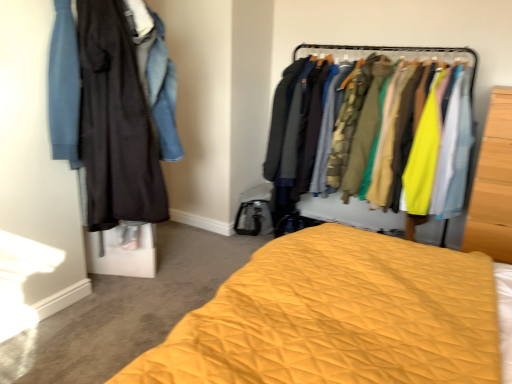
Question: Does textured fabric clothes at center appear on the left side of wooden wardrobe at right?

Choices:
 (A) yes
 (B) no

Answer: (A)

Question: Considering the relative sizes of textured fabric clothes at center and wooden wardrobe at right in the image provided, is textured fabric clothes at center taller than wooden wardrobe at right?

Choices:
 (A) yes
 (B) no

Answer: (A)

Question: Can you confirm if textured fabric clothes at center is bigger than wooden wardrobe at right?

Choices:
 (A) no
 (B) yes

Answer: (B)

Question: Does textured fabric clothes at center appear on the right side of wooden wardrobe at right?

Choices:
 (A) yes
 (B) no

Answer: (B)

Question: Would you say textured fabric clothes at center contains wooden wardrobe at right?

Choices:
 (A) yes
 (B) no

Answer: (B)

Question: Do you think matte black coat at left, which appears as the 1th clothing when ordered from the bottom, is within denim jacket at left, the 2th clothing ordered from the bottom, or outside of it?

Choices:
 (A) outside
 (B) inside

Answer: (A)

Question: In terms of width, does matte black coat at left, placed as the second clothing when sorted from top to bottom, look wider or thinner when compared to denim jacket at left, which is counted as the first clothing, starting from the top?

Choices:
 (A) thin
 (B) wide

Answer: (A)

Question: From the image's perspective, is matte black coat at left, placed as the second clothing when sorted from top to bottom, positioned above or below denim jacket at left, which is counted as the first clothing, starting from the top?

Choices:
 (A) below
 (B) above

Answer: (A)

Question: Is matte black coat at left, placed as the second clothing when sorted from top to bottom, to the left or to the right of denim jacket at left, which is counted as the first clothing, starting from the top, in the image?

Choices:
 (A) right
 (B) left

Answer: (B)

Question: Considering the positions of textured fabric clothes at center and denim jacket at left, which is counted as the first clothing, starting from the top, in the image, is textured fabric clothes at center bigger or smaller than denim jacket at left, which is counted as the first clothing, starting from the top,?

Choices:
 (A) small
 (B) big

Answer: (B)

Question: Which is correct: textured fabric clothes at center is inside denim jacket at left, which is counted as the first clothing, starting from the top, or outside of it?

Choices:
 (A) inside
 (B) outside

Answer: (B)

Question: From a real-world perspective, is textured fabric clothes at center physically located above or below denim jacket at left, which is counted as the first clothing, starting from the top?

Choices:
 (A) below
 (B) above

Answer: (A)

Question: Is textured fabric clothes at center wider or thinner than denim jacket at left, the 2th clothing ordered from the bottom?

Choices:
 (A) thin
 (B) wide

Answer: (B)

Question: Is wooden wardrobe at right taller or shorter than yellow quilted bed at center?

Choices:
 (A) tall
 (B) short

Answer: (A)

Question: From the image's perspective, relative to yellow quilted bed at center, is wooden wardrobe at right above or below?

Choices:
 (A) below
 (B) above

Answer: (B)